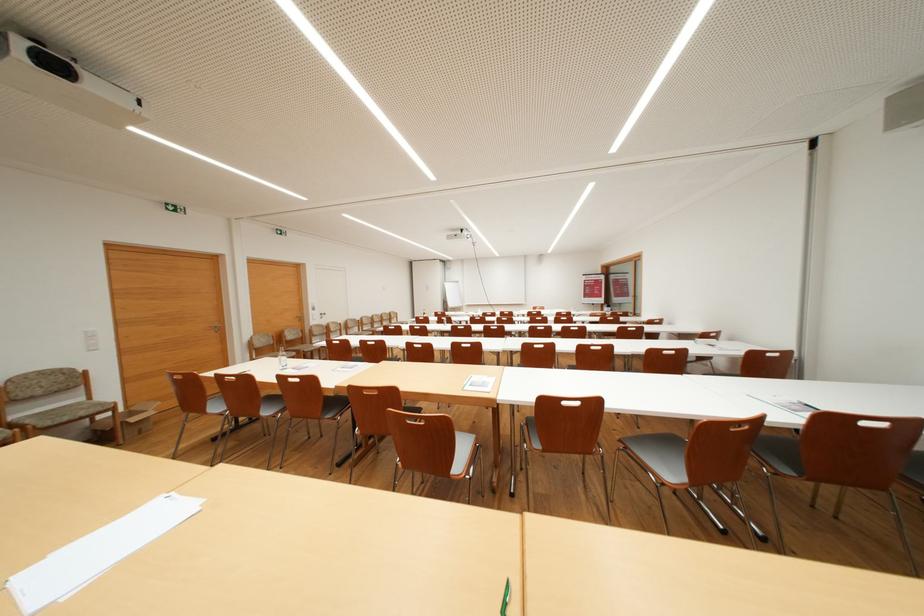
Identify the location of silver door handle. (215, 328).